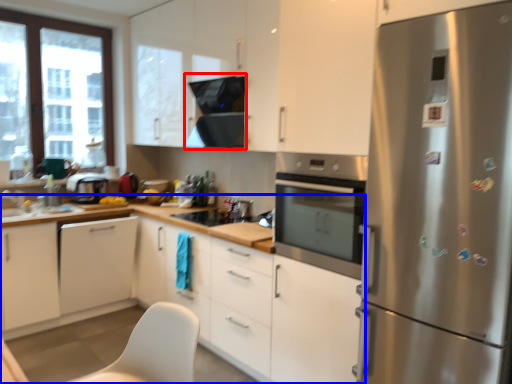
Question: Which point is closer to the camera, exhaust hood (highlighted by a red box) or cabinetry (highlighted by a blue box)?

Choices:
 (A) exhaust hood
 (B) cabinetry

Answer: (B)